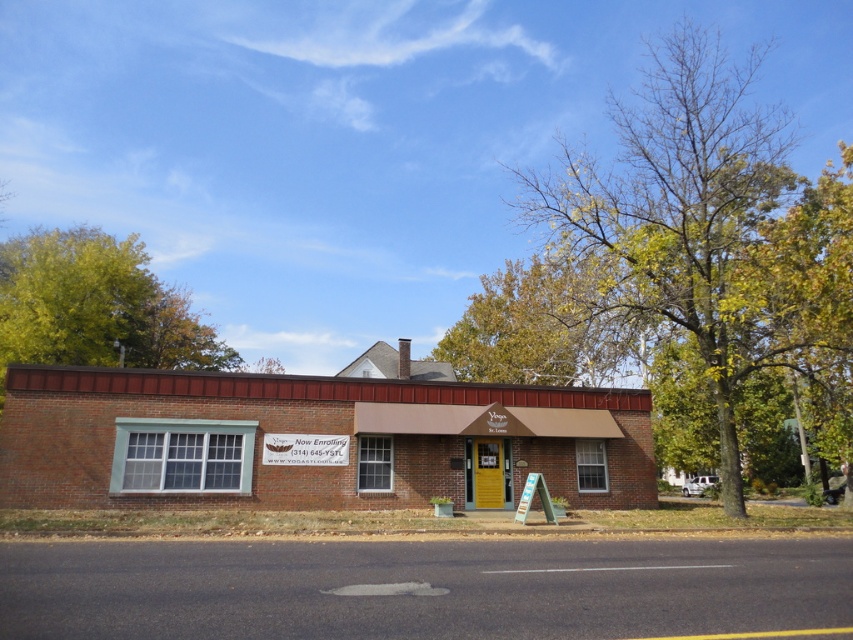
Question: Is green leafy tree at center thinner than green leafy tree at upper left?

Choices:
 (A) no
 (B) yes

Answer: (A)

Question: Which object is farther from the camera taking this photo?

Choices:
 (A) green leafy tree at upper left
 (B) brick building at center

Answer: (A)

Question: Can you confirm if green leafy tree at center is bigger than green leafy tree at upper left?

Choices:
 (A) yes
 (B) no

Answer: (A)

Question: Estimate the real-world distances between objects in this image. Which object is farther from the green leafy tree at center?

Choices:
 (A) brick building at center
 (B) green leafy tree at upper left
 (C) yellow-green leaves at upper center

Answer: (B)

Question: Which point is farther from the camera taking this photo?

Choices:
 (A) (44, 492)
 (B) (482, 314)
 (C) (83, 285)
 (D) (730, 134)

Answer: (B)

Question: Can you confirm if brick building at center is thinner than yellow-green leaves at upper center?

Choices:
 (A) no
 (B) yes

Answer: (A)